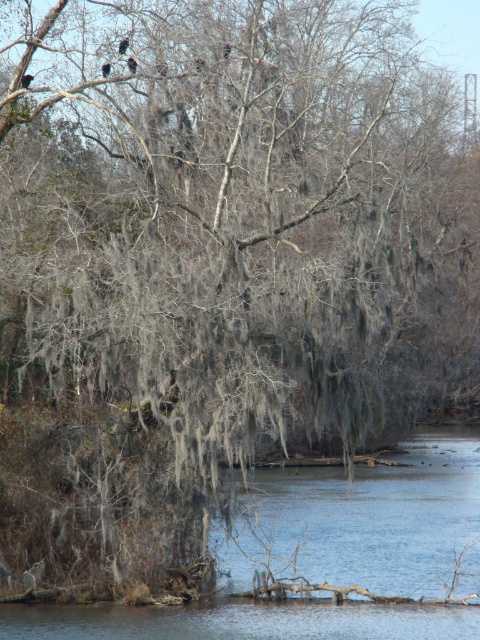
Does black glossy bird at upper center have a smaller size compared to black matte bird at upper center?

Indeed, black glossy bird at upper center has a smaller size compared to black matte bird at upper center.

In the scene shown: Does black glossy bird at upper center have a greater width compared to black matte bird at upper center?

No, black glossy bird at upper center is not wider than black matte bird at upper center.

This screenshot has height=640, width=480. What are the coordinates of `black glossy bird at upper center` in the screenshot? It's located at (25, 81).

Image resolution: width=480 pixels, height=640 pixels. What are the coordinates of `black glossy bird at upper center` in the screenshot? It's located at (25, 81).

Looking at this image, is dark gray feathers at upper center to the left of dark brown feathers at upper center from the viewer's perspective?

No, dark gray feathers at upper center is not to the left of dark brown feathers at upper center.

Is dark gray feathers at upper center above dark brown feathers at upper center?

Correct, dark gray feathers at upper center is located above dark brown feathers at upper center.

Which is in front, point (134, 60) or point (106, 65)?

Point (134, 60) is in front.

The image size is (480, 640). In order to click on dark gray feathers at upper center in this screenshot , I will do tap(132, 65).

Is black glossy bird at upper center wider than dark brown feathers at upper center?

Correct, the width of black glossy bird at upper center exceeds that of dark brown feathers at upper center.

Which of these two, black glossy bird at upper center or dark brown feathers at upper center, stands shorter?

Standing shorter between the two is dark brown feathers at upper center.

The height and width of the screenshot is (640, 480). What are the coordinates of `black glossy bird at upper center` in the screenshot? It's located at (25, 81).